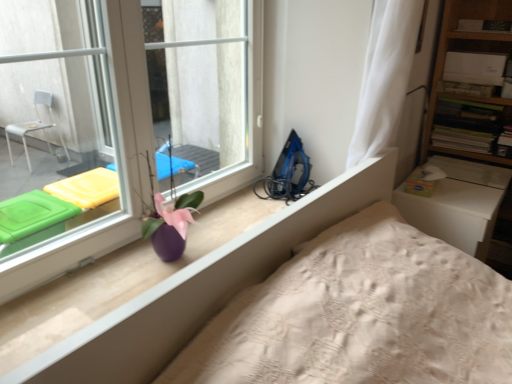
Question: Should I look upward or downward to see purple glossy vase at center?

Choices:
 (A) up
 (B) down

Answer: (B)

Question: From the image's perspective, is blue plastic iron at right under white sheer curtain at upper right?

Choices:
 (A) no
 (B) yes

Answer: (B)

Question: Is white sheer curtain at upper right a part of blue plastic iron at right?

Choices:
 (A) yes
 (B) no

Answer: (B)

Question: Is blue plastic iron at right closer to camera compared to white sheer curtain at upper right?

Choices:
 (A) yes
 (B) no

Answer: (B)

Question: Is blue plastic iron at right facing towards white sheer curtain at upper right?

Choices:
 (A) no
 (B) yes

Answer: (A)

Question: Considering the relative positions of blue plastic iron at right and white sheer curtain at upper right in the image provided, is blue plastic iron at right to the right of white sheer curtain at upper right from the viewer's perspective?

Choices:
 (A) no
 (B) yes

Answer: (A)

Question: Is white sheer curtain at upper right at the back of blue plastic iron at right?

Choices:
 (A) yes
 (B) no

Answer: (B)

Question: From a real-world perspective, is transparent glass window at upper left under wooden bookshelf at upper right?

Choices:
 (A) no
 (B) yes

Answer: (A)

Question: Can you confirm if transparent glass window at upper left is bigger than wooden bookshelf at upper right?

Choices:
 (A) no
 (B) yes

Answer: (B)

Question: Is transparent glass window at upper left outside of wooden bookshelf at upper right?

Choices:
 (A) yes
 (B) no

Answer: (A)

Question: From a real-world perspective, is transparent glass window at upper left located higher than wooden bookshelf at upper right?

Choices:
 (A) yes
 (B) no

Answer: (A)

Question: Is the position of transparent glass window at upper left more distant than that of wooden bookshelf at upper right?

Choices:
 (A) no
 (B) yes

Answer: (A)

Question: Is transparent glass window at upper left to the right of wooden bookshelf at upper right from the viewer's perspective?

Choices:
 (A) no
 (B) yes

Answer: (A)

Question: Considering the relative sizes of purple glossy vase at center and wooden bookshelf at upper right in the image provided, is purple glossy vase at center thinner than wooden bookshelf at upper right?

Choices:
 (A) no
 (B) yes

Answer: (B)